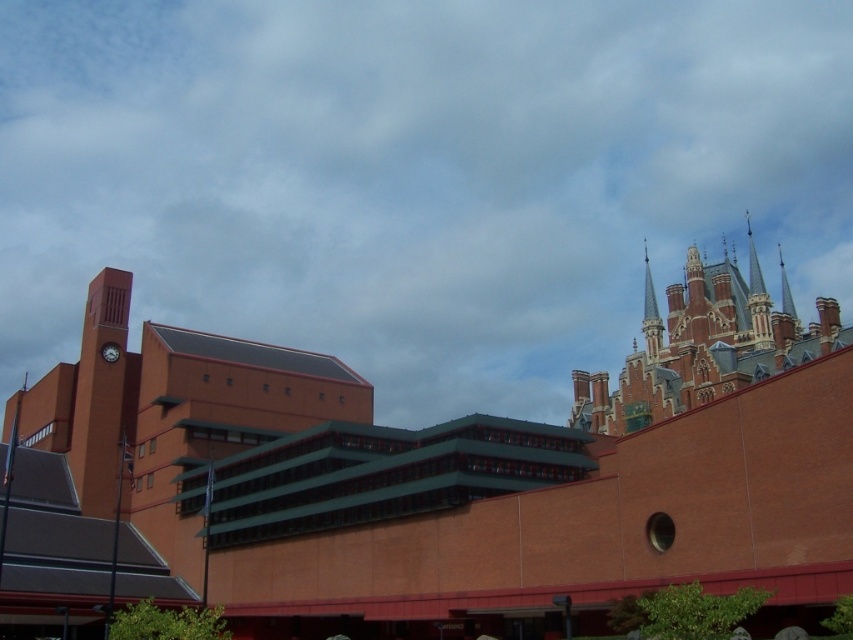
You are an architect analyzing the two clock structures in the image. Which one would you say is taller, the matte orange clock tower at left or the matte gray clock at upper left?

The matte orange clock tower at left is taller than the matte gray clock at upper left.

You are an architect analyzing the spatial layout of the scene. Given that the matte orange clock tower at left is located at coordinates 0.619 on the x axis and 0.118 on the y axis, can you determine its position relative to the center of the image?

The matte orange clock tower at left is positioned to the left and lower than the center of the image since its x coordinate is 0.619, which is to the right of center, and y coordinate 0.118 is lower than center. Wait, actually, in standard image coordinates, the origin is at the top left corner, so x increases to the right and y increases downward. Therefore, the center would be at approximately 0.5 on both axes. Since the clock tower has an x of 0.619, which is greater than 0.5, it is to the right of the

You are standing in the middle of the street between the matte orange clock tower at left and the matte gray clock at upper left. Which clock is higher up in the sky?

The matte gray clock at upper left is higher up in the sky than the matte orange clock tower at left.